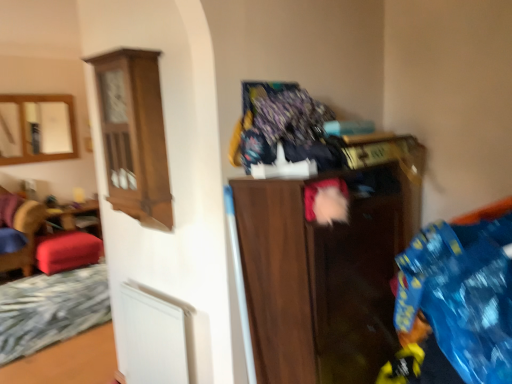
Question: Is matte wood mirror at upper left positioned before velvet red stool at left?

Choices:
 (A) no
 (B) yes

Answer: (A)

Question: Is matte wood mirror at upper left at the left side of velvet red stool at left?

Choices:
 (A) yes
 (B) no

Answer: (A)

Question: Does matte wood mirror at upper left have a greater height compared to velvet red stool at left?

Choices:
 (A) yes
 (B) no

Answer: (A)

Question: Is velvet red stool at left located within matte wood mirror at upper left?

Choices:
 (A) no
 (B) yes

Answer: (A)

Question: From a real-world perspective, is matte wood mirror at upper left over velvet red stool at left?

Choices:
 (A) no
 (B) yes

Answer: (B)

Question: Is fluffy multicolored blanket at upper center in front of or behind white matte bed frame at lower left in the image?

Choices:
 (A) behind
 (B) front

Answer: (B)

Question: Considering the positions of point (269, 115) and point (10, 326), is point (269, 115) closer or farther from the camera than point (10, 326)?

Choices:
 (A) farther
 (B) closer

Answer: (B)

Question: Is fluffy multicolored blanket at upper center bigger or smaller than white matte bed frame at lower left?

Choices:
 (A) small
 (B) big

Answer: (A)

Question: Which is correct: fluffy multicolored blanket at upper center is inside white matte bed frame at lower left, or outside of it?

Choices:
 (A) outside
 (B) inside

Answer: (A)

Question: Is matte wood mirror at upper left situated inside white matte bed frame at lower left or outside?

Choices:
 (A) outside
 (B) inside

Answer: (A)

Question: From the image's perspective, is matte wood mirror at upper left positioned above or below white matte bed frame at lower left?

Choices:
 (A) below
 (B) above

Answer: (B)

Question: Is matte wood mirror at upper left taller or shorter than white matte bed frame at lower left?

Choices:
 (A) short
 (B) tall

Answer: (B)

Question: Relative to white matte bed frame at lower left, is matte wood mirror at upper left in front or behind?

Choices:
 (A) front
 (B) behind

Answer: (B)

Question: Is dark wood cabinet at center to the left or to the right of fluffy multicolored blanket at upper center in the image?

Choices:
 (A) right
 (B) left

Answer: (A)

Question: In the image, is dark wood cabinet at center positioned in front of or behind fluffy multicolored blanket at upper center?

Choices:
 (A) front
 (B) behind

Answer: (A)